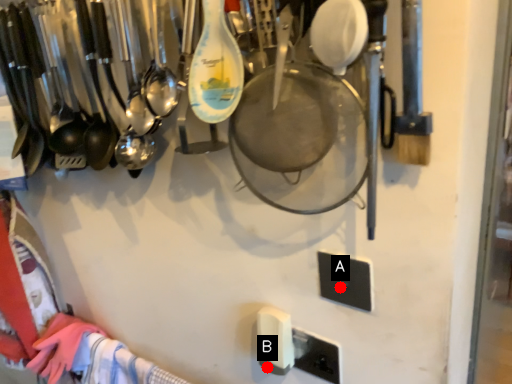
Question: Two points are circled on the image, labeled by A and B beside each circle. Among these points, which one is nearest to the camera?

Choices:
 (A) A is closer
 (B) B is closer

Answer: (A)